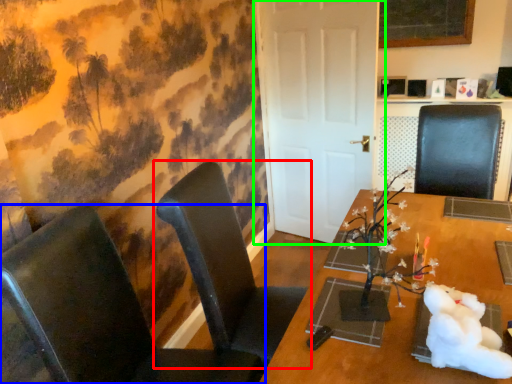
Question: Which is nearer to the chair (highlighted by a red box)? chair (highlighted by a blue box) or door (highlighted by a green box).

Choices:
 (A) chair
 (B) door

Answer: (A)